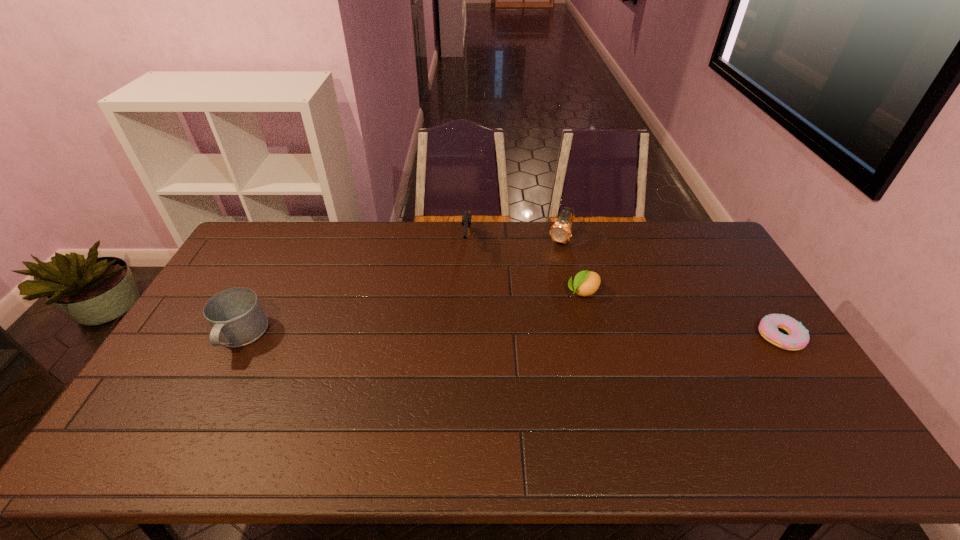
Identify the location of empty space between the gun and the fourth tallest object. This screenshot has height=540, width=960. (525, 269).

At what (x,y) coordinates should I click in order to perform the action: click on free space between the gun and the mug. Please return your answer as a coordinate pair (x, y). This screenshot has width=960, height=540. Looking at the image, I should click on (354, 291).

I want to click on vacant region between the fourth tallest object and the gun, so coord(525,269).

Where is `empty space that is in between the watch and the second shortest object`? The image size is (960, 540). empty space that is in between the watch and the second shortest object is located at coordinates (572, 266).

The image size is (960, 540). I want to click on free spot between the fourth tallest object and the mug, so click(x=412, y=314).

The height and width of the screenshot is (540, 960). I want to click on free area in between the lemon and the watch, so click(572, 266).

You are a GUI agent. You are given a task and a screenshot of the screen. Output one action in this format:
    pyautogui.click(x=<x>, y=<y>)
    Task: Click on the object that ranks as the third closest to the second object from left to right
    This screenshot has width=960, height=540.
    Given the screenshot: What is the action you would take?
    pyautogui.click(x=236, y=317)

Locate which object ranks fourth in proximity to the shortest object. Please provide its 2D coordinates. Your answer should be formatted as a tuple, i.e. [(x, y)], where the tuple contains the x and y coordinates of a point satisfying the conditions above.

[(236, 317)]

This screenshot has width=960, height=540. Find the location of `vacant region that satisfies the following two spatial constraints: 1. on the front side of the gun; 2. on the left side of the third farthest object`. vacant region that satisfies the following two spatial constraints: 1. on the front side of the gun; 2. on the left side of the third farthest object is located at coordinates (466, 293).